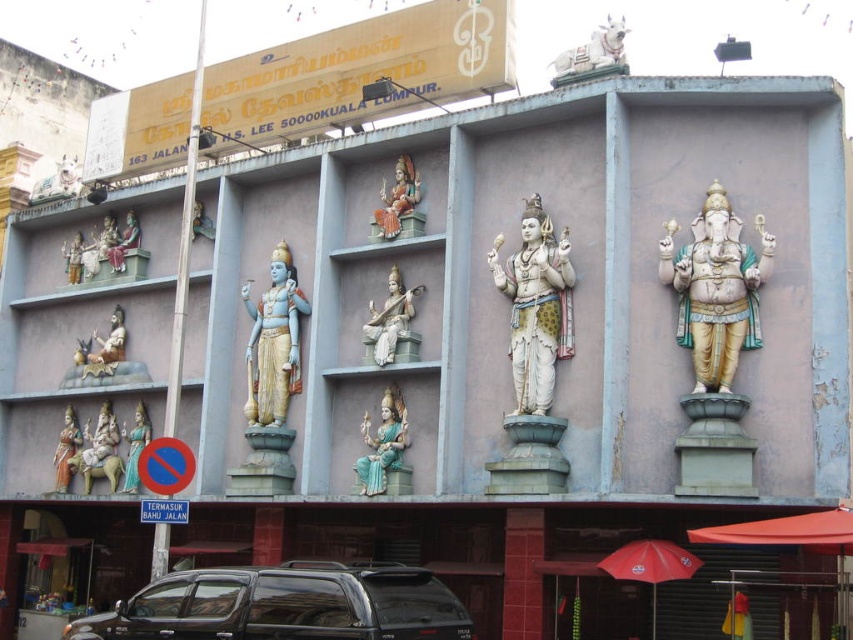
Question: Is black matte suv at lower center closer to the viewer compared to blue painted statue at center left?

Choices:
 (A) no
 (B) yes

Answer: (B)

Question: Which of the following is the farthest from the observer?

Choices:
 (A) (125, 362)
 (B) (407, 202)

Answer: (A)

Question: Is polished gold statue at right above matte white statue at left?

Choices:
 (A) no
 (B) yes

Answer: (A)

Question: Does matte orange statue at center have a larger size compared to white marble statue at upper left?

Choices:
 (A) no
 (B) yes

Answer: (A)

Question: Which point is closer to the camera?

Choices:
 (A) (59, 476)
 (B) (126, 465)
 (C) (111, 241)

Answer: (B)

Question: Which object appears farthest from the camera in this image?

Choices:
 (A) matte orange statue at center
 (B) black matte suv at lower center

Answer: (A)